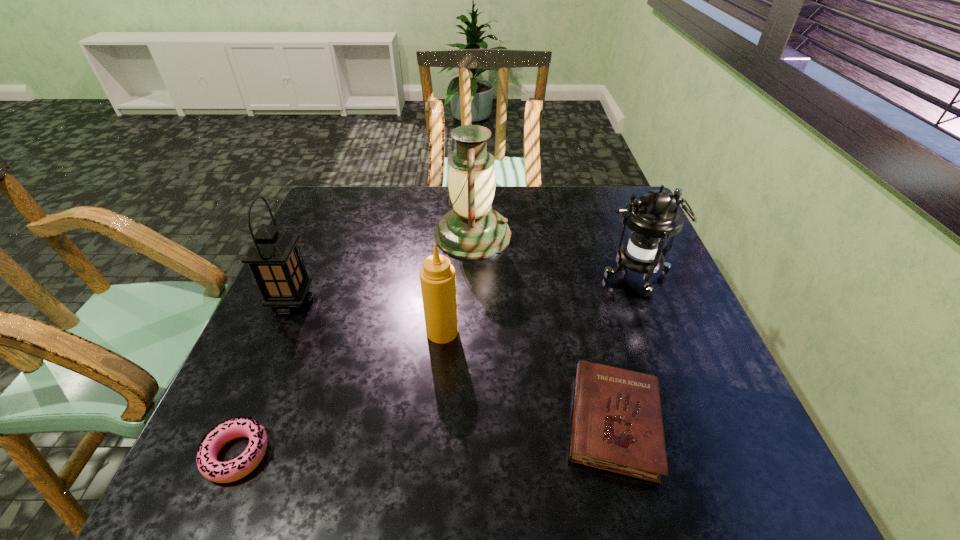
I want to click on the second lantern from right to left, so click(472, 229).

Where is `the leftmost lantern`? Image resolution: width=960 pixels, height=540 pixels. the leftmost lantern is located at coordinates (274, 258).

Find the location of `the rightmost lantern`. the rightmost lantern is located at coordinates (652, 218).

Where is `the fourth farthest object`? The height and width of the screenshot is (540, 960). the fourth farthest object is located at coordinates (437, 276).

Where is `hardback book`? This screenshot has width=960, height=540. hardback book is located at coordinates (617, 426).

The height and width of the screenshot is (540, 960). Find the location of `the shortest object`. the shortest object is located at coordinates (221, 472).

Image resolution: width=960 pixels, height=540 pixels. Identify the location of vacant space located with the light compartment facing forward on the second lantern from left to right. (562, 235).

Locate an element on the screen. vacant space situated on the right of the leftmost lantern is located at coordinates (401, 302).

You are a GUI agent. You are given a task and a screenshot of the screen. Output one action in this format:
    pyautogui.click(x=<x>, y=<y>)
    Task: Click on the free space located 0.110m on the left of the rightmost lantern
    Image resolution: width=960 pixels, height=540 pixels.
    Given the screenshot: What is the action you would take?
    pyautogui.click(x=558, y=277)

Find the location of a particular element. The height and width of the screenshot is (540, 960). vacant region located on the front of the condiment is located at coordinates (438, 385).